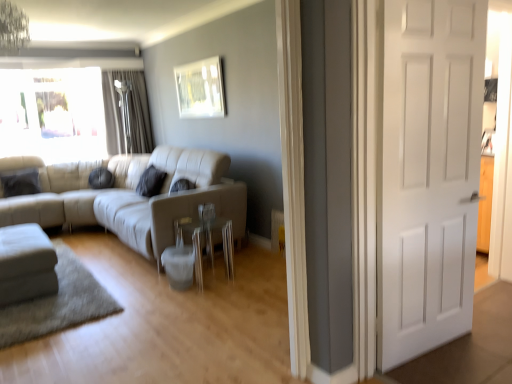
Identify the location of free location to the right of white matte door at right. The image size is (512, 384). (479, 347).